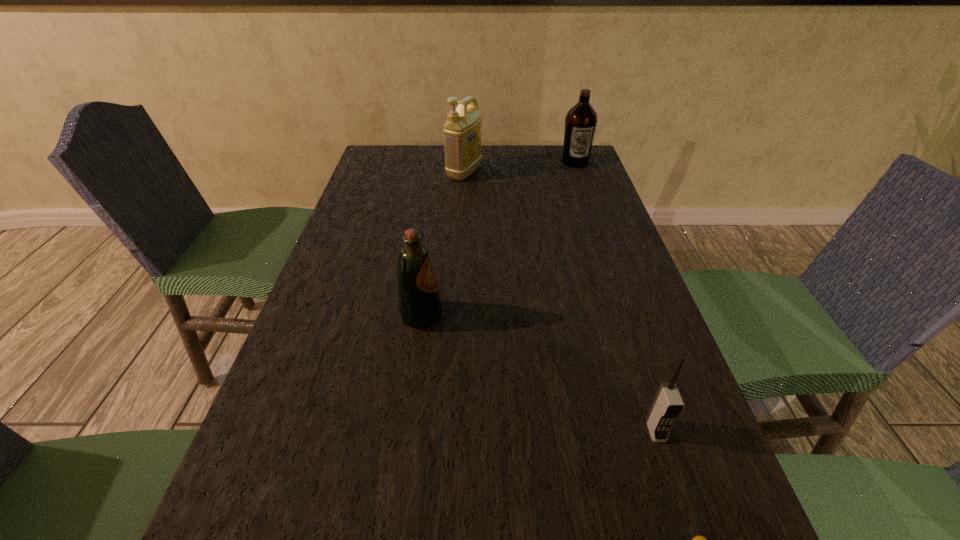
Identify the location of olive oil located at the far edge. The width and height of the screenshot is (960, 540). (581, 120).

Locate an element on the screen. olive oil present at the right edge is located at coordinates (581, 120).

Locate an element on the screen. cellular telephone situated at the right edge is located at coordinates (668, 404).

Where is `object present at the far right corner`? Image resolution: width=960 pixels, height=540 pixels. object present at the far right corner is located at coordinates (581, 120).

Identify the location of vacant space at the far edge. This screenshot has height=540, width=960. (516, 159).

At what (x,y) coordinates should I click in order to perform the action: click on blank area at the left edge. Please return your answer as a coordinate pair (x, y). The image size is (960, 540). Looking at the image, I should click on (379, 225).

At what (x,y) coordinates should I click in order to perform the action: click on vacant region at the right edge of the desktop. Please return your answer as a coordinate pair (x, y). The image size is (960, 540). Looking at the image, I should click on (610, 272).

Where is `unoccupied area between the detergent and the right olive oil`? unoccupied area between the detergent and the right olive oil is located at coordinates (519, 167).

Where is `vacant region between the left olive oil and the second shortest object`? Image resolution: width=960 pixels, height=540 pixels. vacant region between the left olive oil and the second shortest object is located at coordinates (539, 373).

You are a GUI agent. You are given a task and a screenshot of the screen. Output one action in this format:
    pyautogui.click(x=<x>, y=<y>)
    Task: Click on the free space between the left olive oil and the fourth tallest object
    
    Given the screenshot: What is the action you would take?
    pyautogui.click(x=539, y=373)